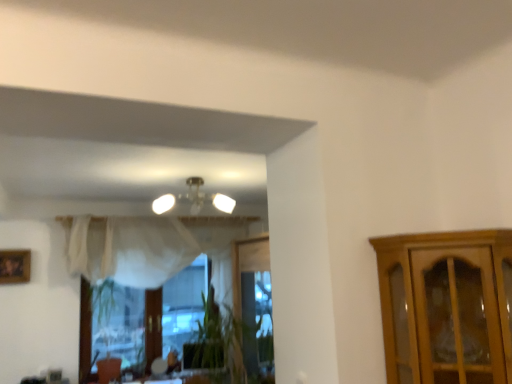
This screenshot has width=512, height=384. What do you see at coordinates (15, 266) in the screenshot? I see `wooden framed photo at lower left` at bounding box center [15, 266].

Identify the location of wooden framed photo at lower left. (15, 266).

What is the approximate width of wooden framed photo at lower left?

The width of wooden framed photo at lower left is 2.86 inches.

Where is `matte white chandelier at upper center`? The width and height of the screenshot is (512, 384). matte white chandelier at upper center is located at coordinates (194, 199).

What do you see at coordinates (194, 199) in the screenshot? I see `matte white chandelier at upper center` at bounding box center [194, 199].

This screenshot has height=384, width=512. Identify the location of wooden framed photo at lower left. (15, 266).

Which is more to the left, wooden framed photo at lower left or matte white chandelier at upper center?

From the viewer's perspective, wooden framed photo at lower left appears more on the left side.

Does wooden framed photo at lower left lie in front of matte white chandelier at upper center?

That is False.

Between point (23, 250) and point (225, 204), which one is positioned in front?

The point (23, 250) is more forward.

From the image's perspective, between wooden framed photo at lower left and matte white chandelier at upper center, who is located below?

wooden framed photo at lower left is shown below in the image.

From a real-world perspective, between wooden framed photo at lower left and matte white chandelier at upper center, who is vertically higher?

From a 3D spatial view, matte white chandelier at upper center is above.

Considering the sizes of objects wooden framed photo at lower left and matte white chandelier at upper center in the image provided, who is thinner, wooden framed photo at lower left or matte white chandelier at upper center?

With smaller width is wooden framed photo at lower left.

Is wooden framed photo at lower left shorter than matte white chandelier at upper center?

No.

Looking at this image, considering the sizes of objects wooden framed photo at lower left and matte white chandelier at upper center in the image provided, who is bigger, wooden framed photo at lower left or matte white chandelier at upper center?

Bigger between the two is matte white chandelier at upper center.

Would you say matte white chandelier at upper center is part of wooden framed photo at lower left's contents?

No, matte white chandelier at upper center is not inside wooden framed photo at lower left.

Would you say wooden framed photo at lower left is a long distance from matte white chandelier at upper center?

Indeed, wooden framed photo at lower left is not near matte white chandelier at upper center.

Is wooden framed photo at lower left turned away from matte white chandelier at upper center?

No, wooden framed photo at lower left is not facing away from matte white chandelier at upper center.

Locate an element on the screen. The height and width of the screenshot is (384, 512). picture frame on the left of matte white chandelier at upper center is located at coordinates (x=15, y=266).

Considering the positions of objects matte white chandelier at upper center and wooden framed photo at lower left in the image provided, who is more to the left, matte white chandelier at upper center or wooden framed photo at lower left?

From the viewer's perspective, wooden framed photo at lower left appears more on the left side.

Is the depth of matte white chandelier at upper center greater than that of wooden framed photo at lower left?

No, the depth of matte white chandelier at upper center is less than that of wooden framed photo at lower left.

Considering the positions of point (185, 195) and point (27, 263), is point (185, 195) closer or farther from the camera than point (27, 263)?

Point (185, 195) is closer to the camera than point (27, 263).

Looking at this image, from the image's perspective, which is above, matte white chandelier at upper center or wooden framed photo at lower left?

matte white chandelier at upper center, from the image's perspective.

From a real-world perspective, is matte white chandelier at upper center below wooden framed photo at lower left?

No.

Looking at this image, considering the relative sizes of matte white chandelier at upper center and wooden framed photo at lower left in the image provided, is matte white chandelier at upper center wider than wooden framed photo at lower left?

Yes.

Is matte white chandelier at upper center shorter than wooden framed photo at lower left?

Yes.

Which of these two, matte white chandelier at upper center or wooden framed photo at lower left, is bigger?

matte white chandelier at upper center is bigger.

Could wooden framed photo at lower left be considered to be inside matte white chandelier at upper center?

No.

Is matte white chandelier at upper center not near wooden framed photo at lower left?

matte white chandelier at upper center is positioned a significant distance from wooden framed photo at lower left.

Is matte white chandelier at upper center oriented away from wooden framed photo at lower left?

No, matte white chandelier at upper center's orientation is not away from wooden framed photo at lower left.

How many degrees apart are the facing directions of matte white chandelier at upper center and wooden framed photo at lower left?

There is a 1.74-degree angle between the facing directions of matte white chandelier at upper center and wooden framed photo at lower left.

The image size is (512, 384). Identify the location of picture frame behind the matte white chandelier at upper center. (15, 266).

This screenshot has width=512, height=384. In the image, there is a matte white chandelier at upper center. In order to click on picture frame below it (from the image's perspective) in this screenshot , I will do `click(15, 266)`.

I want to click on lamp above the wooden framed photo at lower left (from a real-world perspective), so [x=194, y=199].